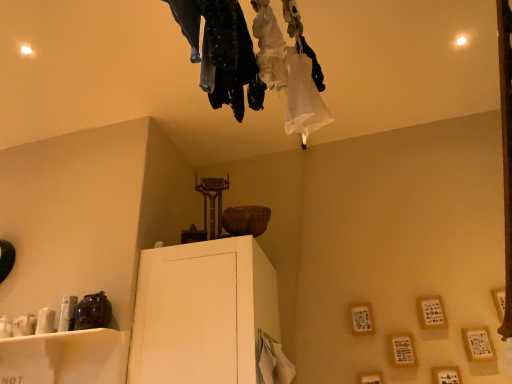
Question: Considering the positions of white matte cabinet at center, the first furniture viewed from the right, and white glossy shelf at lower left, which is the 2th furniture in right-to-left order, in the image, is white matte cabinet at center, the first furniture viewed from the right, taller or shorter than white glossy shelf at lower left, which is the 2th furniture in right-to-left order,?

Choices:
 (A) short
 (B) tall

Answer: (B)

Question: Is white matte cabinet at center, the first furniture viewed from the right, spatially inside white glossy shelf at lower left, the 1th furniture in the left-to-right sequence, or outside of it?

Choices:
 (A) outside
 (B) inside

Answer: (A)

Question: Based on their relative distances, which object is farther from the white matte cabinet at center, the first furniture viewed from the right?

Choices:
 (A) dark textured pants at upper center
 (B) white glossy shelf at lower left, the 1th furniture in the left-to-right sequence

Answer: (A)

Question: Estimate the real-world distances between objects in this image. Which object is closer to the dark textured pants at upper center?

Choices:
 (A) white glossy shelf at lower left, which is the 2th furniture in right-to-left order
 (B) white matte cabinet at center, which appears as the second furniture when viewed from the left

Answer: (B)